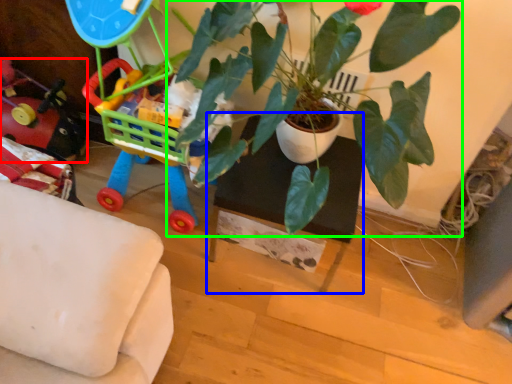
Question: Which object is positioned closest to toy (highlighted by a red box)? Select from table (highlighted by a blue box) and houseplant (highlighted by a green box).

Choices:
 (A) table
 (B) houseplant

Answer: (A)